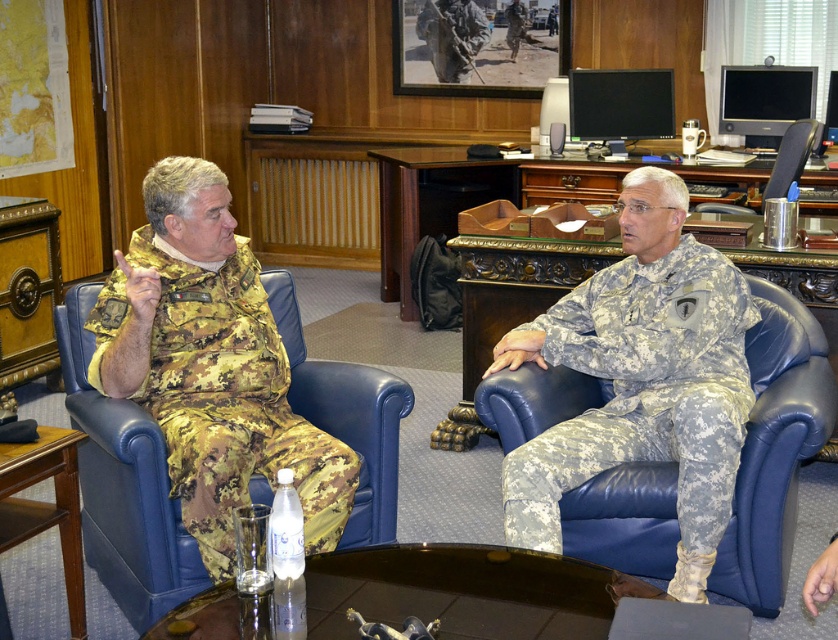
Who is positioned more to the right, camouflage fabric uniform at right or wooden table at lower left?

camouflage fabric uniform at right

What are the coordinates of `camouflage fabric uniform at right` in the screenshot? It's located at (643, 392).

You are a GUI agent. You are given a task and a screenshot of the screen. Output one action in this format:
    pyautogui.click(x=<x>, y=<y>)
    Task: Click on the camouflage fabric uniform at right
    
    Given the screenshot: What is the action you would take?
    pyautogui.click(x=643, y=392)

Between wooden desk at center and blue leather armchair at right, which one appears on the left side from the viewer's perspective?

wooden desk at center

Is the position of wooden desk at center more distant than that of blue leather armchair at right?

Yes, wooden desk at center is further from the viewer.

Which is in front, point (511, 161) or point (782, 148)?

Positioned in front is point (782, 148).

Locate an element on the screen. The width and height of the screenshot is (838, 640). wooden desk at center is located at coordinates (425, 204).

Who is shorter, wooden table at lower left or blue leather armchair at right?

With less height is blue leather armchair at right.

Is wooden table at lower left above blue leather armchair at right?

No.

I want to click on wooden table at lower left, so click(x=45, y=506).

Image resolution: width=838 pixels, height=640 pixels. What are the coordinates of `wooden table at lower left` in the screenshot? It's located at (45, 506).